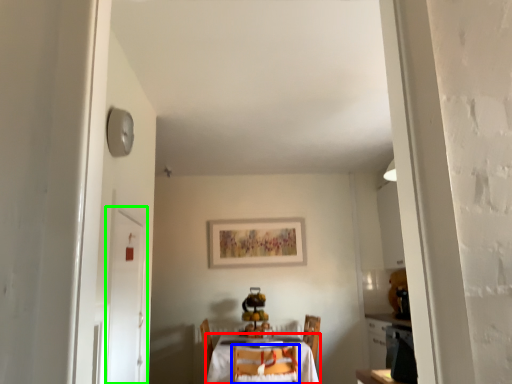
Question: Considering the real-world distances, which object is closest to table (highlighted by a red box)? chair (highlighted by a blue box) or door (highlighted by a green box).

Choices:
 (A) chair
 (B) door

Answer: (A)